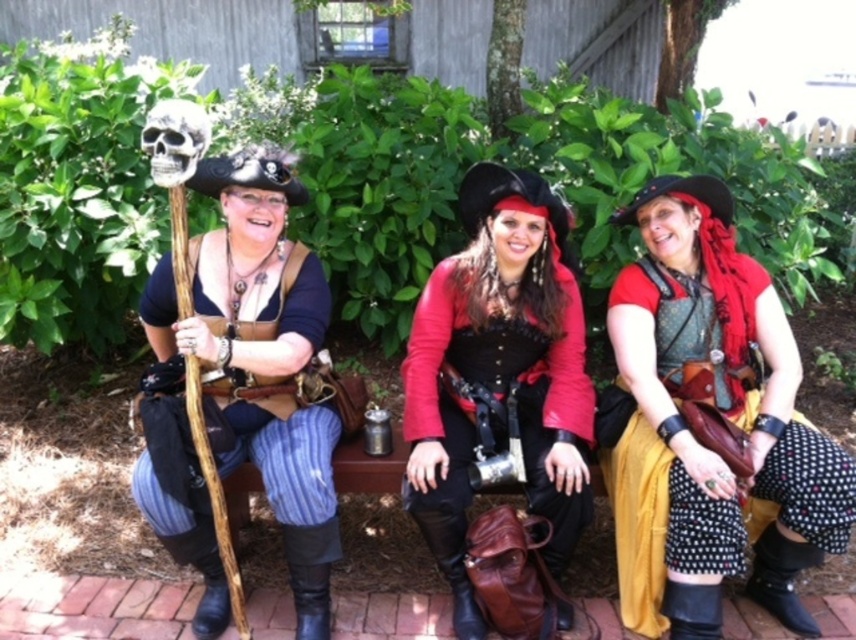
Question: Which object is closer to the camera taking this photo?

Choices:
 (A) shiny red fabric at center
 (B) matte black vest at center

Answer: (B)

Question: Estimate the real-world distances between objects in this image. Which object is farther from the matte black vest at center?

Choices:
 (A) matte brown leather staff at left
 (B) gray matte skull at center
 (C) shiny red fabric at center

Answer: (B)

Question: Does matte brown leather staff at left lie in front of gray matte skull at center?

Choices:
 (A) yes
 (B) no

Answer: (B)

Question: Which point is farther from the camera taking this photo?

Choices:
 (A) (186, 156)
 (B) (547, 440)
 (C) (159, 508)
 (D) (729, 538)

Answer: (B)

Question: Can you confirm if matte brown leather staff at left is bigger than gray matte skull at center?

Choices:
 (A) yes
 (B) no

Answer: (A)

Question: Where is shiny red fabric at center located in relation to matte brown leather staff at left in the image?

Choices:
 (A) below
 (B) above

Answer: (A)